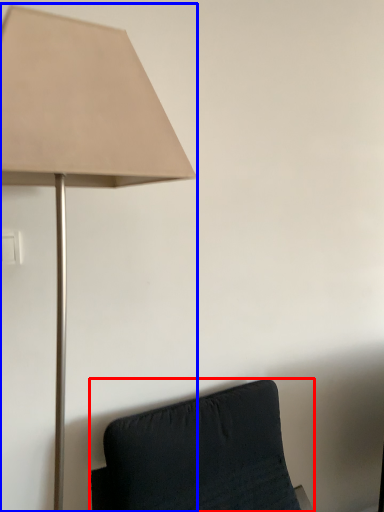
Question: Among these objects, which one is farthest to the camera, furniture (highlighted by a red box) or lamp (highlighted by a blue box)?

Choices:
 (A) furniture
 (B) lamp

Answer: (A)